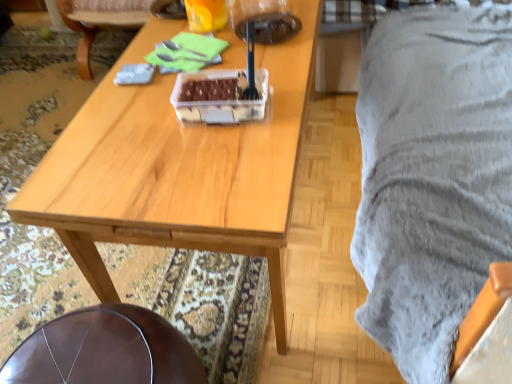
Question: Is leather seat at lower left, the first chair positioned from the bottom, behind brown leather chair at center, which ranks as the first chair in back-to-front order?

Choices:
 (A) no
 (B) yes

Answer: (A)

Question: From a real-world perspective, does leather seat at lower left, the second chair from the back, stand above brown leather chair at center, the second chair in the bottom-to-top sequence?

Choices:
 (A) yes
 (B) no

Answer: (B)

Question: Is brown leather chair at center, which appears as the second chair when viewed from the front, completely or partially inside leather seat at lower left, the first chair positioned from the bottom?

Choices:
 (A) no
 (B) yes

Answer: (A)

Question: Does leather seat at lower left, which is the first chair from front to back, have a lesser width compared to brown leather chair at center, the second chair in the bottom-to-top sequence?

Choices:
 (A) no
 (B) yes

Answer: (B)

Question: Is leather seat at lower left, the second chair from the back, positioned far away from brown leather chair at center, the second chair in the bottom-to-top sequence?

Choices:
 (A) no
 (B) yes

Answer: (B)

Question: From the image's perspective, is brown leather chair at center, the first chair from the top, located above or below wooden table at center?

Choices:
 (A) above
 (B) below

Answer: (A)

Question: In the image, is brown leather chair at center, which appears as the second chair when viewed from the front, on the left side or the right side of wooden table at center?

Choices:
 (A) right
 (B) left

Answer: (B)

Question: Is brown leather chair at center, the second chair in the bottom-to-top sequence, wider or thinner than wooden table at center?

Choices:
 (A) thin
 (B) wide

Answer: (B)

Question: Considering the positions of point (97, 16) and point (268, 210), is point (97, 16) closer or farther from the camera than point (268, 210)?

Choices:
 (A) closer
 (B) farther

Answer: (B)

Question: Looking at their shapes, would you say brown leather chair at center, which ranks as the first chair in back-to-front order, is wider or thinner than translucent plastic container at center?

Choices:
 (A) thin
 (B) wide

Answer: (B)

Question: Is brown leather chair at center, the second chair in the bottom-to-top sequence, situated inside translucent plastic container at center or outside?

Choices:
 (A) outside
 (B) inside

Answer: (A)

Question: Is point (141, 21) positioned closer to the camera than point (197, 76)?

Choices:
 (A) farther
 (B) closer

Answer: (A)

Question: In terms of height, does brown leather chair at center, which appears as the second chair when viewed from the front, look taller or shorter compared to translucent plastic container at center?

Choices:
 (A) tall
 (B) short

Answer: (A)

Question: Is leather seat at lower left, the first chair positioned from the bottom, spatially inside translucent plastic cup at upper center, or outside of it?

Choices:
 (A) inside
 (B) outside

Answer: (B)

Question: Is point (144, 316) closer or farther from the camera than point (201, 26)?

Choices:
 (A) farther
 (B) closer

Answer: (B)